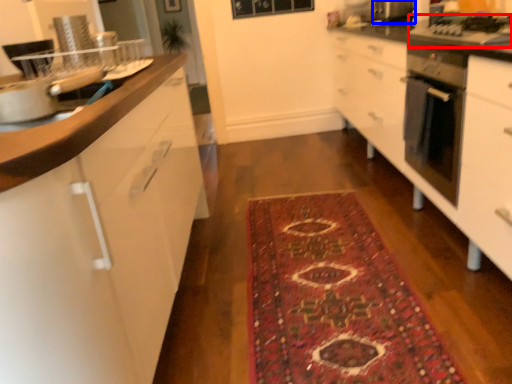
Question: Which object appears closest to the camera in this image, gas stove (highlighted by a red box) or appliance (highlighted by a blue box)?

Choices:
 (A) gas stove
 (B) appliance

Answer: (A)